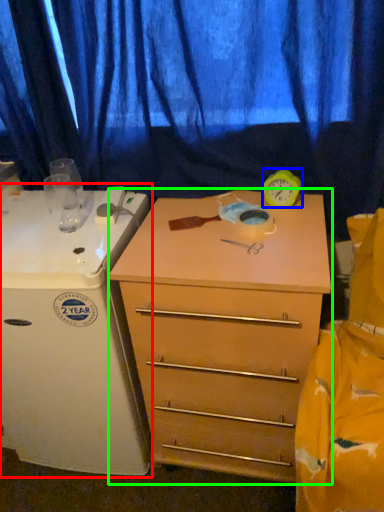
Question: Which is nearer to the appliance (highlighted by a red box)? clock (highlighted by a blue box) or chest of drawers (highlighted by a green box).

Choices:
 (A) clock
 (B) chest of drawers

Answer: (B)